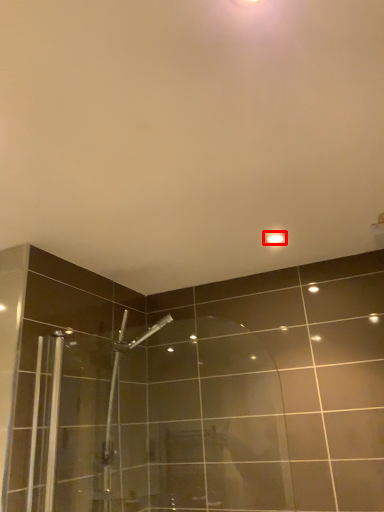
Question: Considering the relative positions of light fixture (annotated by the red box) and shower door in the image provided, where is light fixture (annotated by the red box) located with respect to the staircase?

Choices:
 (A) left
 (B) right

Answer: (B)